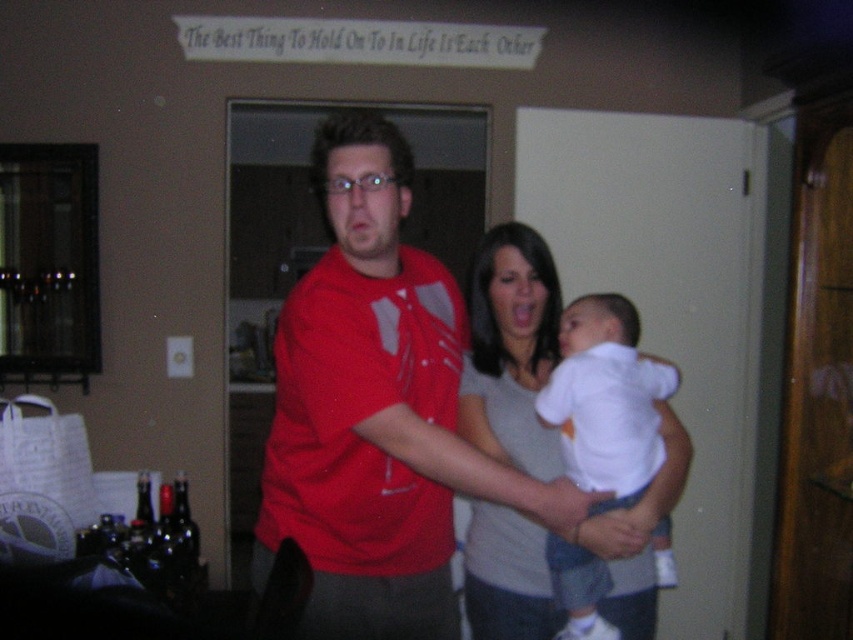
Question: Which point is closer to the camera taking this photo?

Choices:
 (A) (589, 396)
 (B) (300, 433)

Answer: (B)

Question: Is matte red shirt at center smaller than white soft fabric baby at center?

Choices:
 (A) no
 (B) yes

Answer: (A)

Question: Is matte red shirt at center behind white soft fabric baby at center?

Choices:
 (A) yes
 (B) no

Answer: (B)

Question: Which of the following is the farthest from the observer?

Choices:
 (A) white soft fabric baby at center
 (B) matte red shirt at center

Answer: (A)

Question: Is matte red shirt at center further to camera compared to white soft fabric baby at center?

Choices:
 (A) yes
 (B) no

Answer: (B)